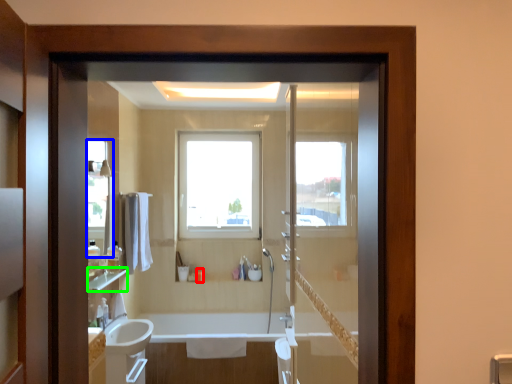
Question: Which object is the farthest from toiletry (highlighted by a red box)? Choose among these: mirror (highlighted by a blue box) or balustrade (highlighted by a green box).

Choices:
 (A) mirror
 (B) balustrade

Answer: (A)